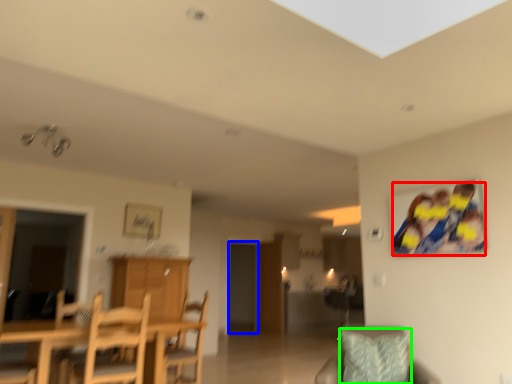
Question: Which is farther away from couple (highlighted by a red box)? glass door (highlighted by a blue box) or pillow (highlighted by a green box)?

Choices:
 (A) glass door
 (B) pillow

Answer: (A)